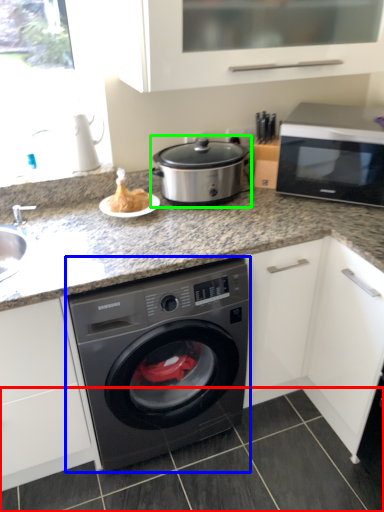
Question: Which object is the farthest from tile (highlighted by a red box)? Choose among these: washing machine (highlighted by a blue box) or slow cooker (highlighted by a green box).

Choices:
 (A) washing machine
 (B) slow cooker

Answer: (B)